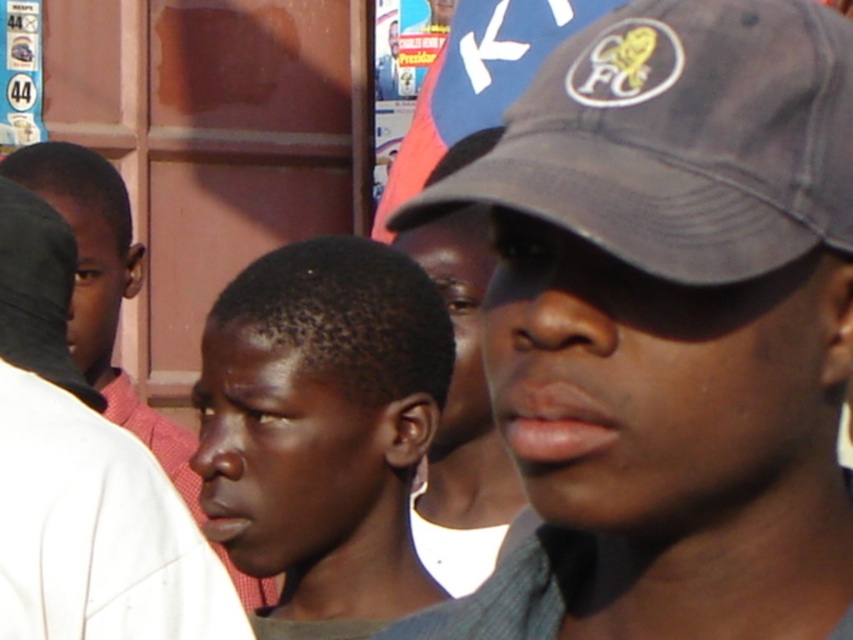
Question: Which object appears closest to the camera in this image?

Choices:
 (A) dark gray fabric baseball cap at upper right
 (B) matte black cap at upper right

Answer: (A)

Question: Does dark gray fabric baseball cap at upper right have a greater width compared to matte black cap at upper right?

Choices:
 (A) yes
 (B) no

Answer: (A)

Question: Does dark gray cap at center appear over dark skin smooth face at center?

Choices:
 (A) no
 (B) yes

Answer: (B)

Question: Does dark gray fabric baseball cap at upper right appear on the right side of dark skin smooth face at center?

Choices:
 (A) yes
 (B) no

Answer: (A)

Question: Which point is closer to the camera?

Choices:
 (A) dark gray fabric baseball cap at upper right
 (B) dark gray cap at center
 (C) matte black cap at upper right

Answer: (A)

Question: Which of the following is the closest to the observer?

Choices:
 (A) black matte cap at left
 (B) smooth skin face at center

Answer: (A)